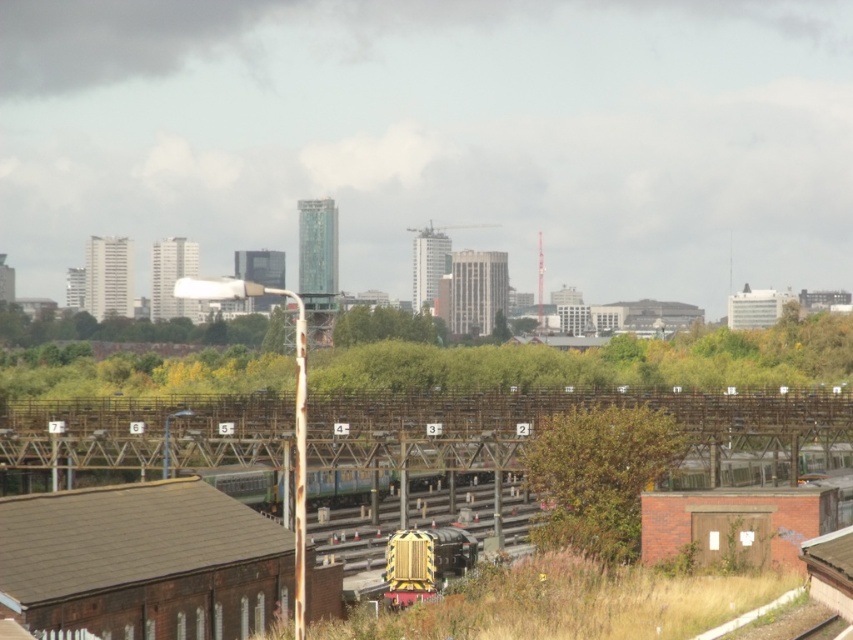
From the picture: You are a photographer planning to take a photo of the brown textured bush at center and the yellow matte train at center in the urban landscape scene. Which object should you focus on first if you want to capture both in a single frame without moving the camera?

The brown textured bush at center is bigger than the yellow matte train at center, so focusing on the larger object first would ensure both fit well in the frame.

You are standing at the center of the railway yard and want to place a new sign exactly where the brown textured bush at center is located. What are the coordinates of the point where you should place the sign?

The coordinates for the brown textured bush at center are at point (598, 476), so you should place the sign there.

You are a maintenance worker needing to access the yellow matte train at center. There is a brown textured bush at center blocking your path. Can you walk around the bush to reach the train?

The brown textured bush at center is positioned over the yellow matte train at center, so the bush is directly above the train. This means you cannot walk around it to reach the train as it is blocking the path from above.